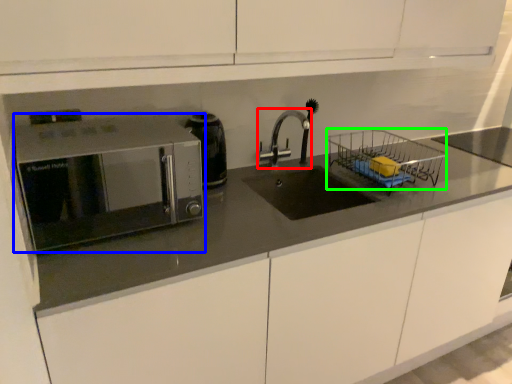
Question: Which object is the closest to the tap (highlighted by a red box)? Choose among these: microwave oven (highlighted by a blue box) or basket (highlighted by a green box).

Choices:
 (A) microwave oven
 (B) basket

Answer: (B)